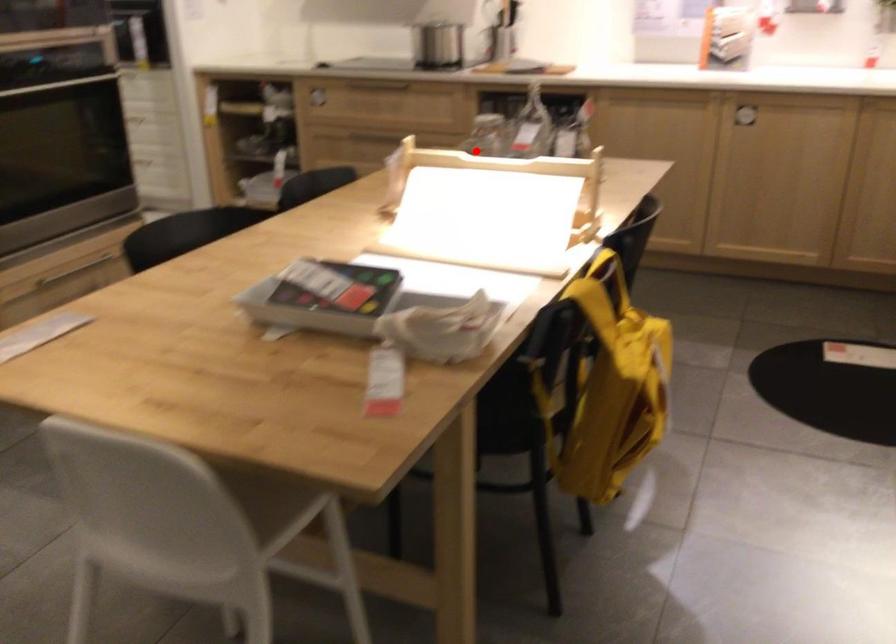
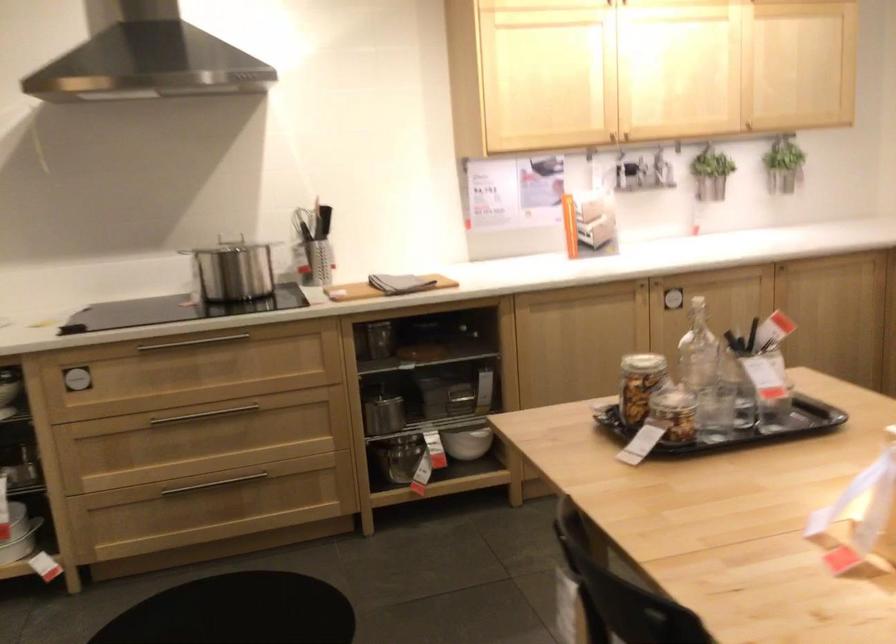
Question: I am providing you with two images of the same scene from different viewpoints. A red point is shown in image1. For the corresponding object point in image2, is it positioned nearer or farther from the camera?

Choices:
 (A) Nearer
 (B) Farther

Answer: (A)